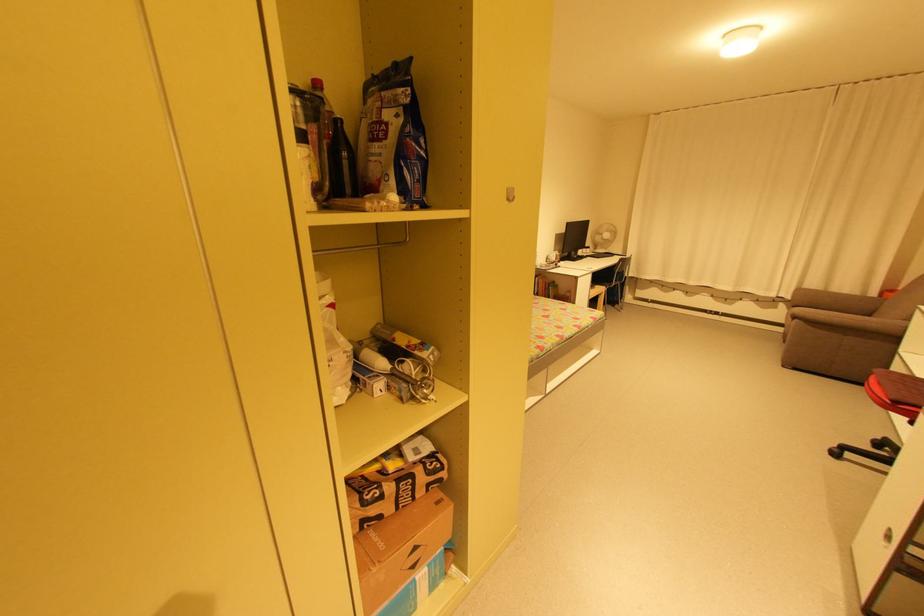
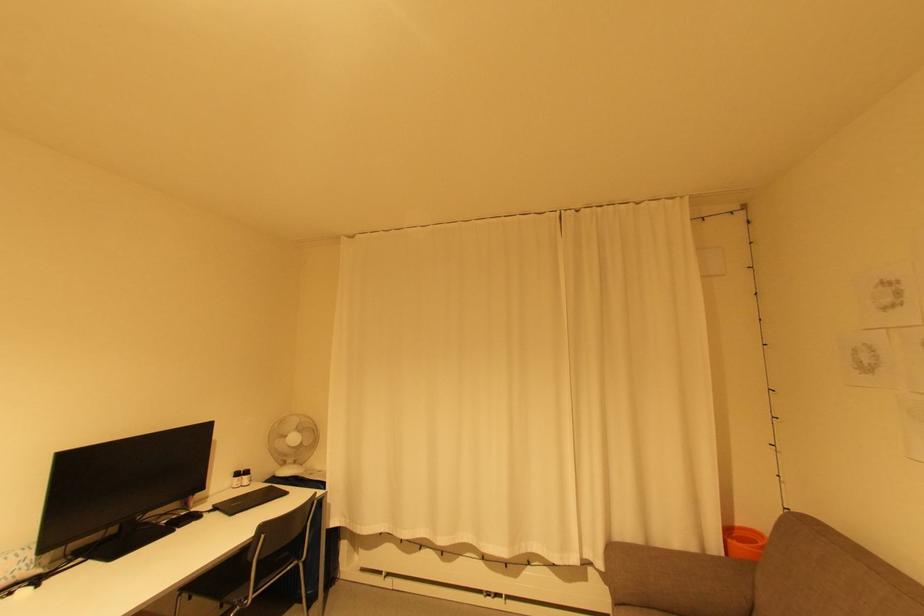
In the second image, find the point that corresponds to point (592, 249) in the first image.

(250, 477)